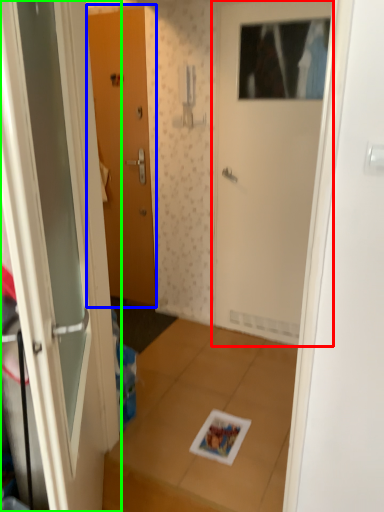
Question: Considering the real-world distances, which object is farthest from door (highlighted by a red box)? door (highlighted by a blue box) or door (highlighted by a green box)?

Choices:
 (A) door
 (B) door

Answer: (B)